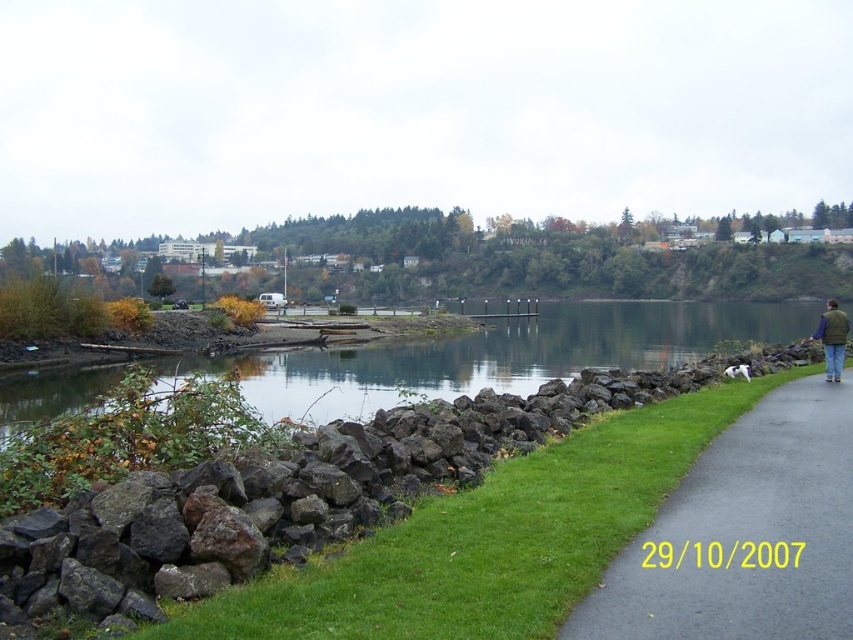
This screenshot has height=640, width=853. Find the location of `black asphalt pavement at lower right`. black asphalt pavement at lower right is located at coordinates (744, 534).

Can you confirm if black asphalt pavement at lower right is positioned below clear water at center?

Yes.

Who is more distant from viewer, (817, 611) or (244, 369)?

The point (244, 369) is more distant.

Find the location of a particular element. Image resolution: width=853 pixels, height=640 pixels. black asphalt pavement at lower right is located at coordinates tap(744, 534).

Is green grass at lower left thinner than black asphalt pavement at lower right?

Incorrect, green grass at lower left's width is not less than black asphalt pavement at lower right's.

Which is above, green grass at lower left or black asphalt pavement at lower right?

green grass at lower left is above.

Image resolution: width=853 pixels, height=640 pixels. What do you see at coordinates (486, 540) in the screenshot?
I see `green grass at lower left` at bounding box center [486, 540].

The image size is (853, 640). Identify the location of green grass at lower left. (486, 540).

Does point (224, 625) come farther from viewer compared to point (263, 358)?

No, it is not.

Which is below, green grass at lower left or clear water at center?

green grass at lower left is below.

Does point (368, 552) come behind point (643, 340)?

That is False.

In order to click on green grass at lower left in this screenshot , I will do `click(486, 540)`.